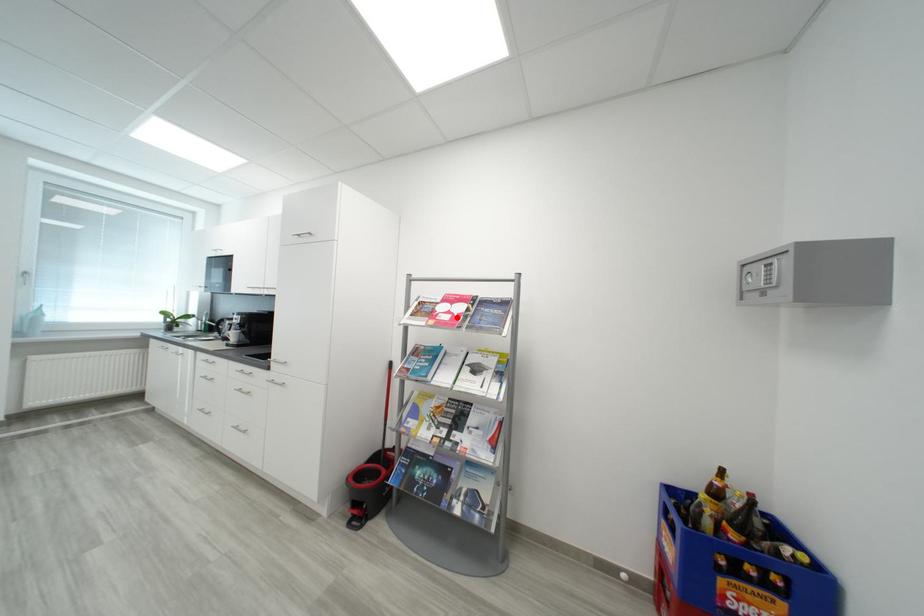
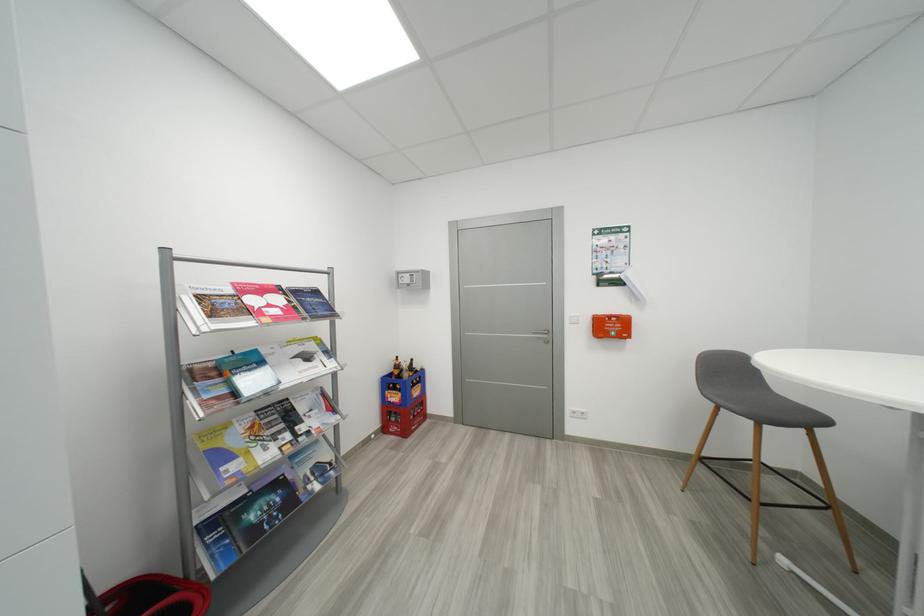
Find the pixel in the second image that matches the highlighted location in the first image.

(286, 310)